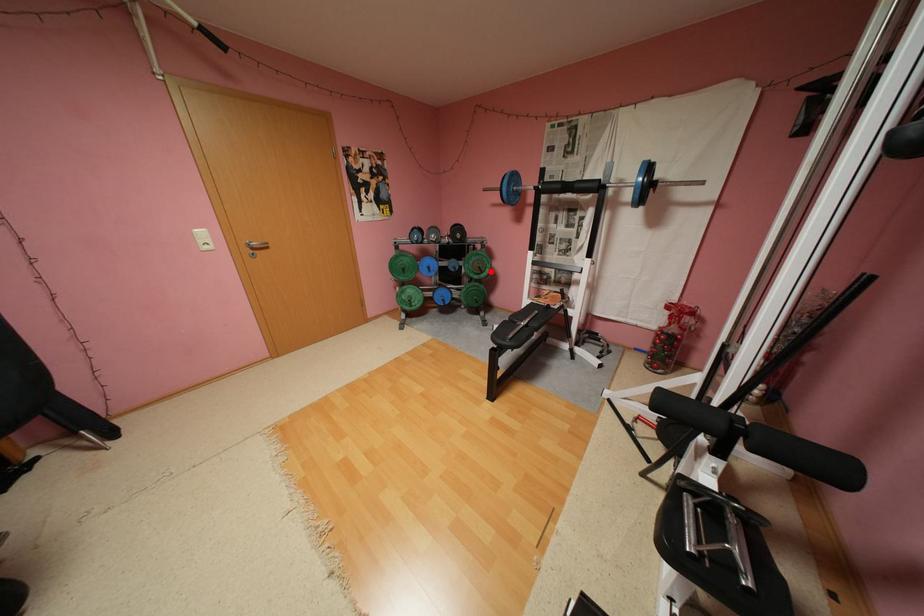
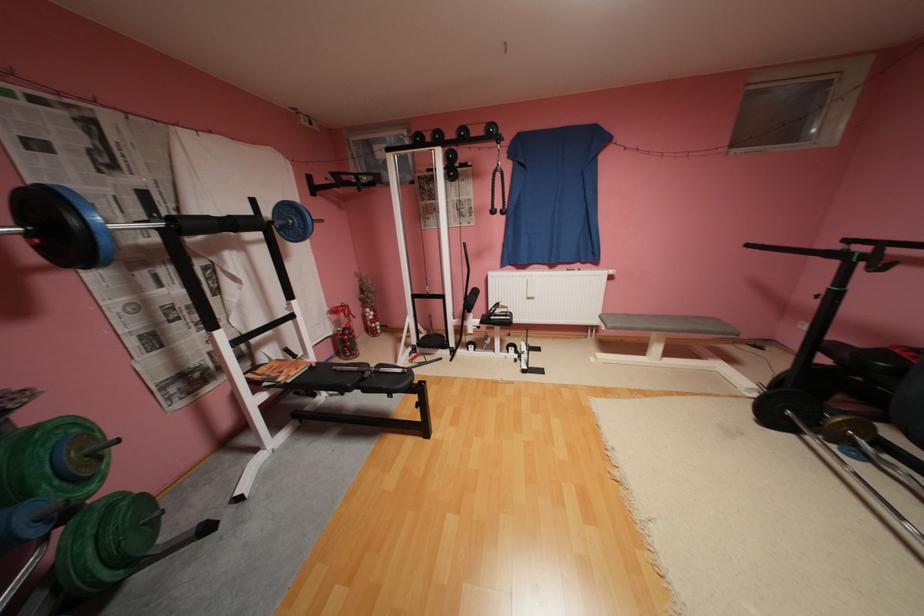
In the second image, find the point that corresponds to the highlighted location in the first image.

(111, 459)